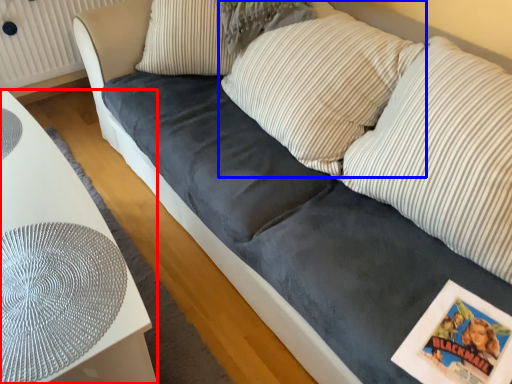
Question: Among these objects, which one is nearest to the camera, furniture (highlighted by a red box) or pillow (highlighted by a blue box)?

Choices:
 (A) furniture
 (B) pillow

Answer: (A)